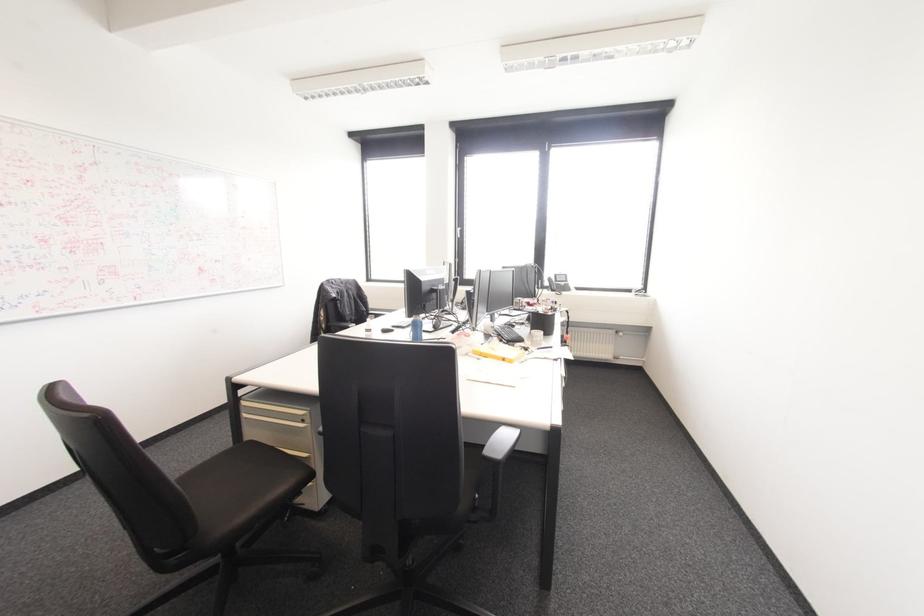
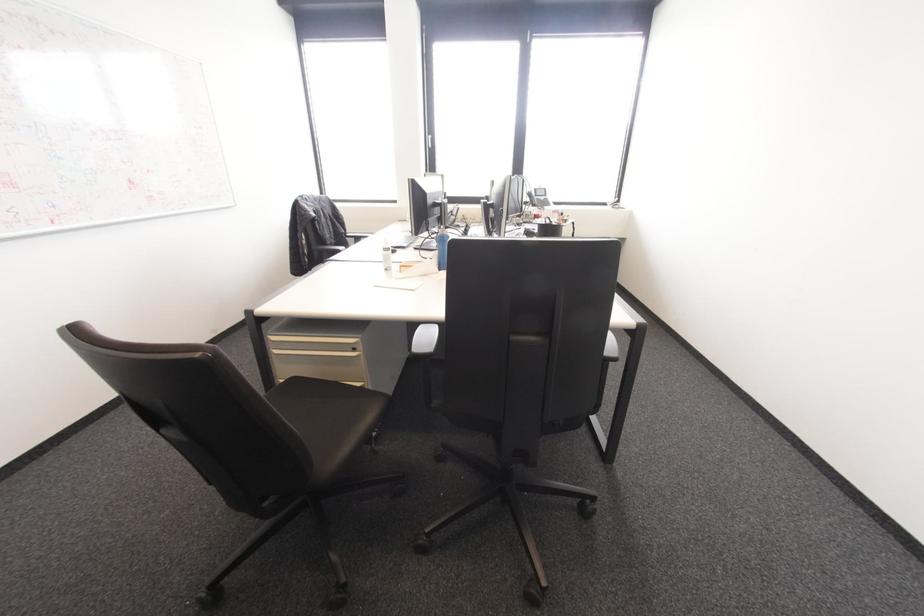
Locate, in the second image, the point that corresponds to point 347,328 in the first image.

(337, 251)